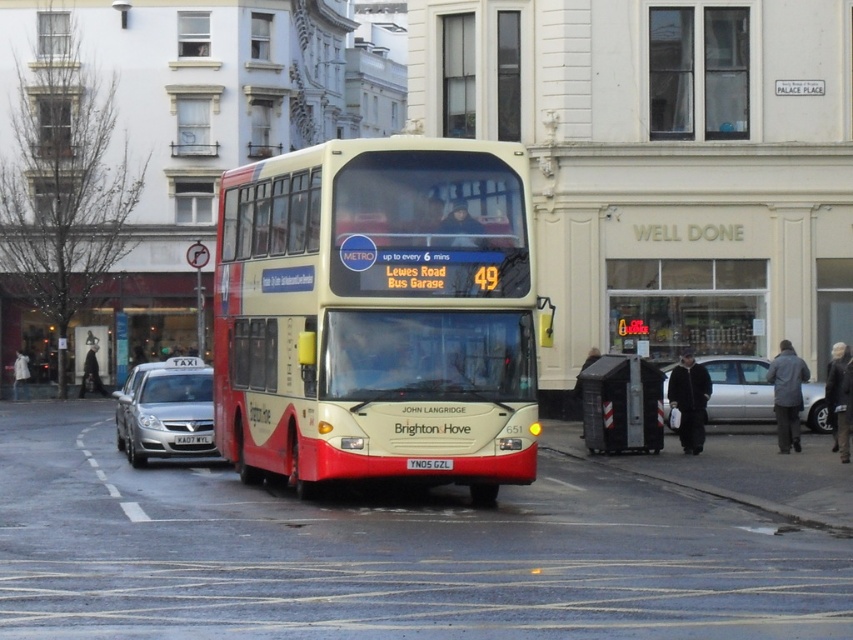
What do you see at coordinates (165, 410) in the screenshot?
I see `silver metallic taxi at left` at bounding box center [165, 410].

You are a GUI agent. You are given a task and a screenshot of the screen. Output one action in this format:
    pyautogui.click(x=<x>, y=<y>)
    Task: Click on the silver metallic taxi at left
    This screenshot has height=640, width=853.
    Given the screenshot: What is the action you would take?
    pyautogui.click(x=165, y=410)

At what (x,y) coordinates should I click in order to perform the action: click on silver metallic taxi at left. Please return your answer as a coordinate pair (x, y). Looking at the image, I should click on (165, 410).

Is matte white and red bus at center below metallic gray bus stop at lower right?

No.

Is matte white and red bus at center positioned at the back of metallic gray bus stop at lower right?

That is False.

The image size is (853, 640). In order to click on matte white and red bus at center in this screenshot , I will do `click(376, 314)`.

Is silver metallic taxi at left positioned before yellow metallic license plate at center?

No, silver metallic taxi at left is further to the viewer.

Between silver metallic taxi at left and yellow metallic license plate at center, which one appears on the left side from the viewer's perspective?

silver metallic taxi at left is more to the left.

At what (x,y) coordinates should I click in order to perform the action: click on silver metallic taxi at left. Please return your answer as a coordinate pair (x, y). The height and width of the screenshot is (640, 853). Looking at the image, I should click on (165, 410).

In order to click on silver metallic taxi at left in this screenshot , I will do `click(165, 410)`.